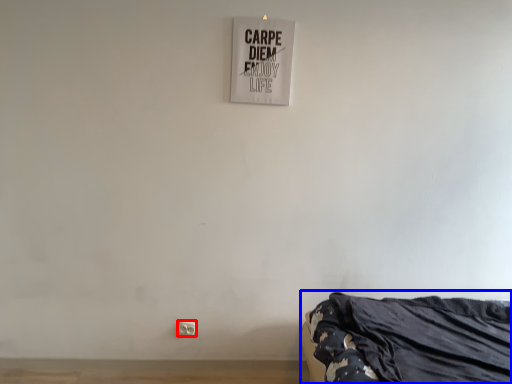
Question: Which point is further to the camera, electric outlet (highlighted by a red box) or furniture (highlighted by a blue box)?

Choices:
 (A) electric outlet
 (B) furniture

Answer: (A)